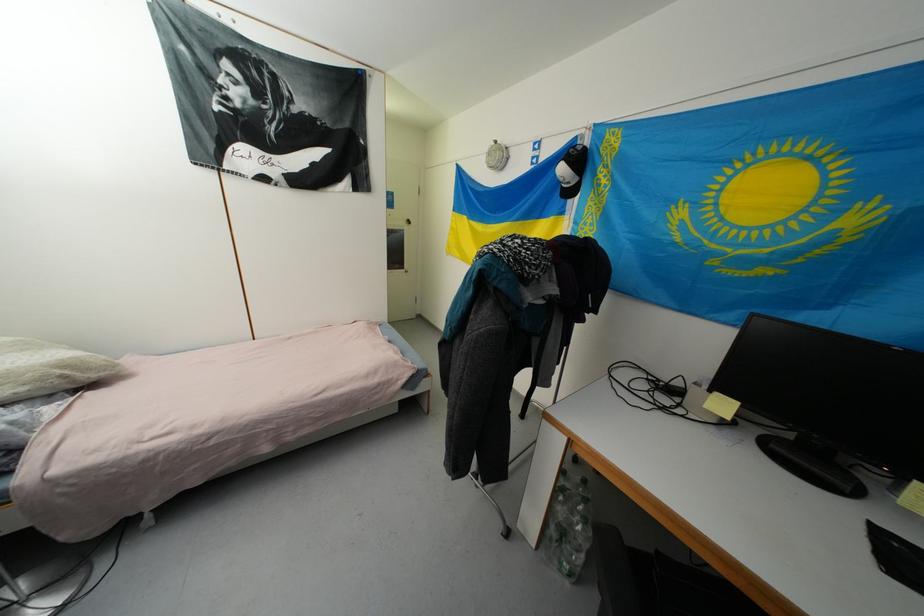
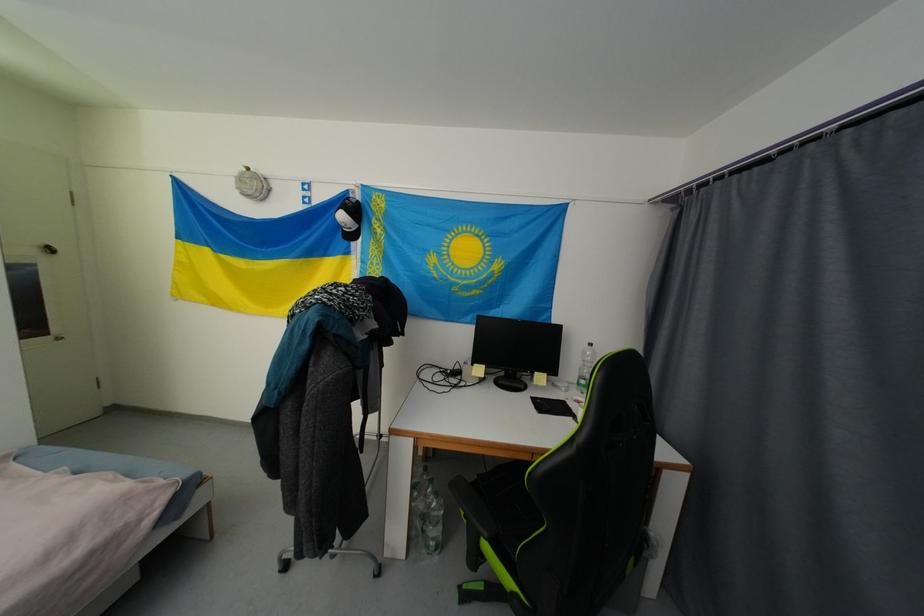
Locate, in the second image, the point that corresponds to point (553, 536) in the first image.

(419, 535)